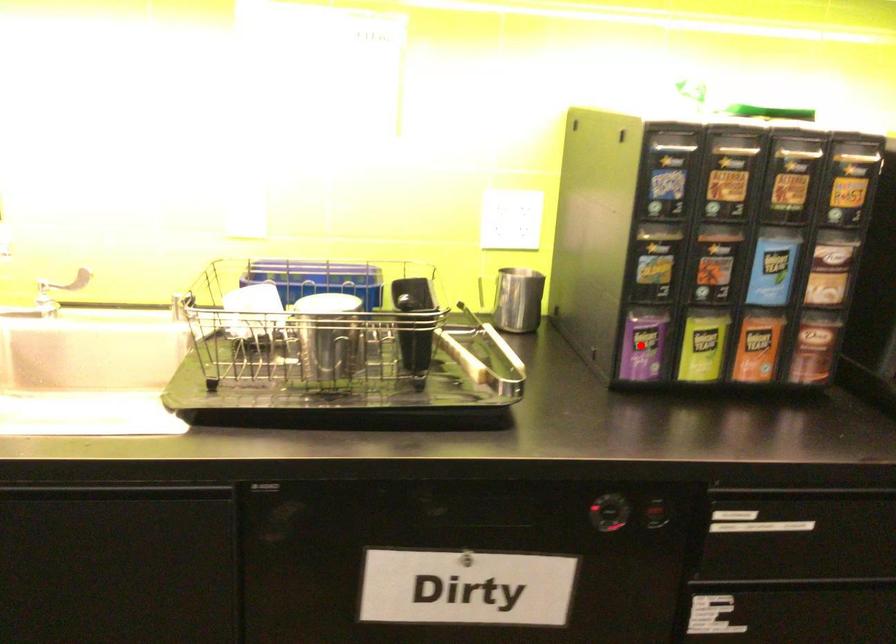
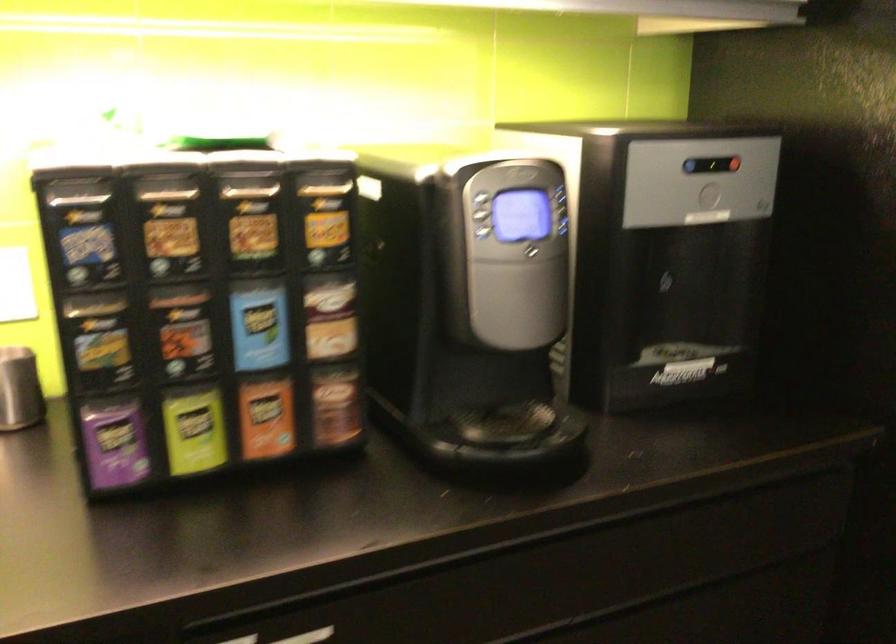
Question: A red point is marked in image1. In image2, is the corresponding 3D point closer to the camera or farther? Reply with the corresponding letter.

Choices:
 (A) The corresponding 3D point is closer.
 (B) The corresponding 3D point is farther.

Answer: (A)